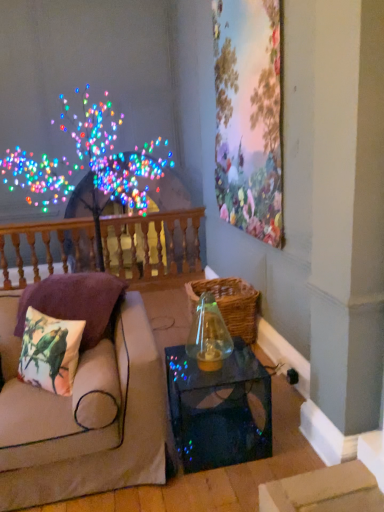
Question: Is printed fabric cushion at left, placed as the 1th pillow when sorted from back to front, smaller than wooden balustrade at upper left?

Choices:
 (A) no
 (B) yes

Answer: (B)

Question: From the image's perspective, is printed fabric cushion at left, which is the 2th pillow in front-to-back order, located above wooden balustrade at upper left?

Choices:
 (A) yes
 (B) no

Answer: (B)

Question: From the image's perspective, is printed fabric cushion at left, which is the 2th pillow in front-to-back order, below wooden balustrade at upper left?

Choices:
 (A) no
 (B) yes

Answer: (B)

Question: Is printed fabric cushion at left, placed as the 1th pillow when sorted from back to front, not close to wooden balustrade at upper left?

Choices:
 (A) yes
 (B) no

Answer: (A)

Question: Considering the relative positions of printed fabric cushion at left, which is the 2th pillow in front-to-back order, and wooden balustrade at upper left in the image provided, is printed fabric cushion at left, which is the 2th pillow in front-to-back order, behind wooden balustrade at upper left?

Choices:
 (A) no
 (B) yes

Answer: (A)

Question: Looking at their shapes, would you say printed fabric cushion at left, which is the 2th pillow in front-to-back order, is wider or thinner than transparent glass table at lower center?

Choices:
 (A) thin
 (B) wide

Answer: (A)

Question: Considering the relative positions of printed fabric cushion at left, placed as the 1th pillow when sorted from back to front, and transparent glass table at lower center in the image provided, is printed fabric cushion at left, placed as the 1th pillow when sorted from back to front, to the left or to the right of transparent glass table at lower center?

Choices:
 (A) left
 (B) right

Answer: (A)

Question: From their relative heights in the image, would you say printed fabric cushion at left, placed as the 1th pillow when sorted from back to front, is taller or shorter than transparent glass table at lower center?

Choices:
 (A) short
 (B) tall

Answer: (A)

Question: Considering the positions of point (31, 295) and point (266, 393), is point (31, 295) closer or farther from the camera than point (266, 393)?

Choices:
 (A) farther
 (B) closer

Answer: (B)

Question: In terms of height, does floral wallpaper at upper right look taller or shorter compared to beige fabric couch at left?

Choices:
 (A) tall
 (B) short

Answer: (A)

Question: Is floral wallpaper at upper right in front of or behind beige fabric couch at left in the image?

Choices:
 (A) behind
 (B) front

Answer: (A)

Question: Based on their positions, is floral wallpaper at upper right located to the left or right of beige fabric couch at left?

Choices:
 (A) right
 (B) left

Answer: (A)

Question: Does point (236, 214) appear closer or farther from the camera than point (122, 365)?

Choices:
 (A) closer
 (B) farther

Answer: (B)

Question: Based on their positions, is printed fabric cushion with parrots at left, the first pillow when ordered from front to back, located to the left or right of transparent glass vase at center?

Choices:
 (A) left
 (B) right

Answer: (A)

Question: In terms of height, does printed fabric cushion with parrots at left, arranged as the 2th pillow when viewed from the back, look taller or shorter compared to transparent glass vase at center?

Choices:
 (A) short
 (B) tall

Answer: (A)